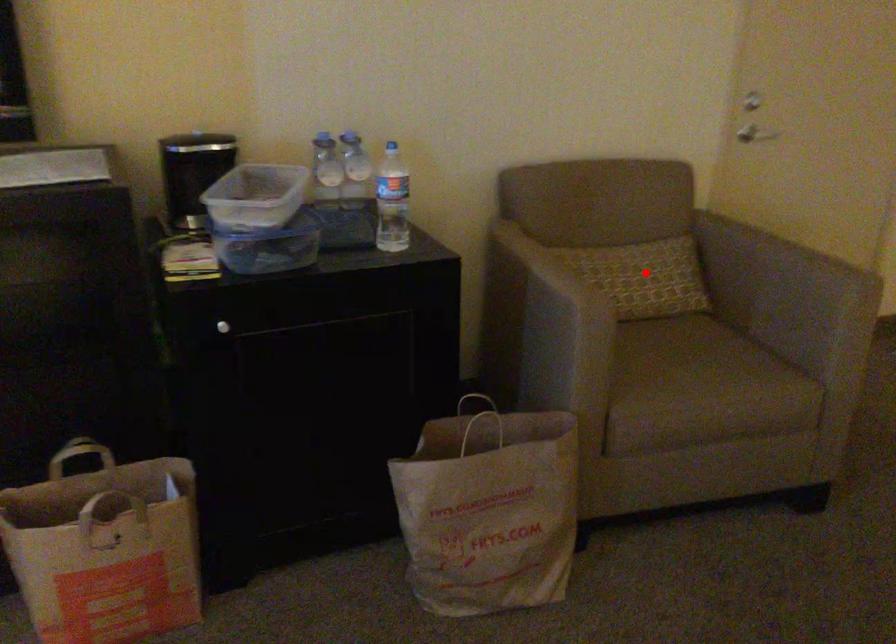
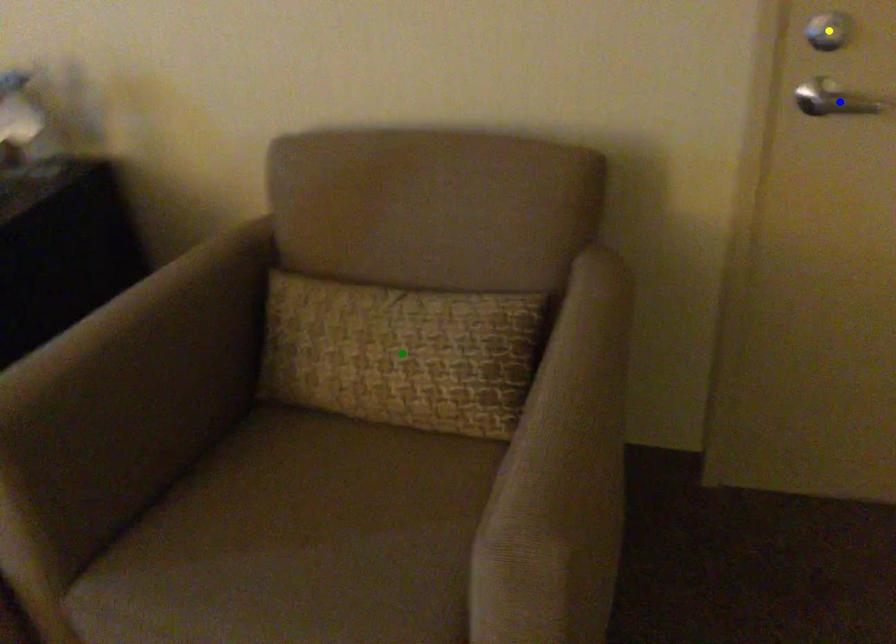
Question: I am providing you with two images of the same scene from different viewpoints. A red point is marked on the first image. You are given multiple points on the second image. In image 2, which mark is for the same physical point as the one in image 1?

Choices:
 (A) blue point
 (B) yellow point
 (C) green point

Answer: (C)